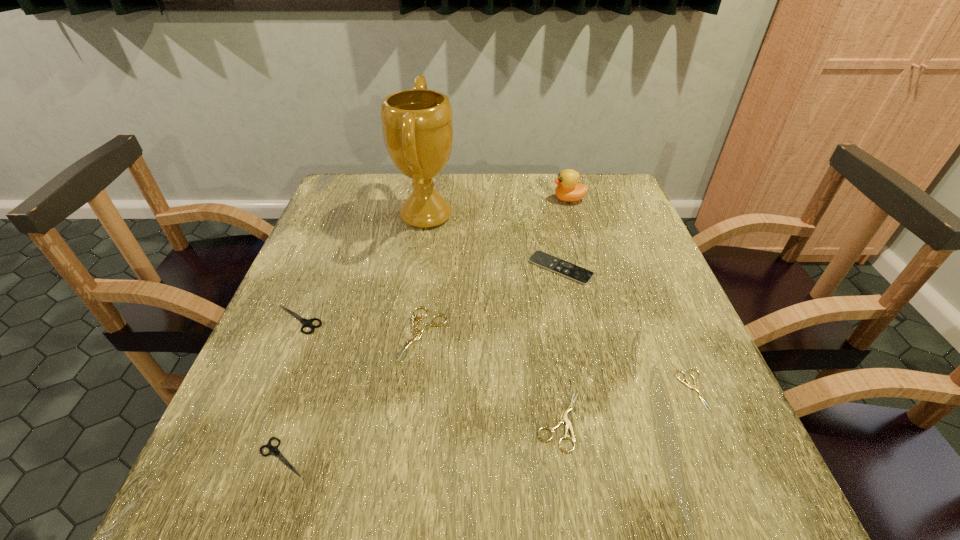
At what (x,y) coordinates should I click in order to perform the action: click on award. Please return your answer as a coordinate pair (x, y). Looking at the image, I should click on [417, 125].

The width and height of the screenshot is (960, 540). Find the location of `the seventh shortest object`. the seventh shortest object is located at coordinates (568, 189).

Where is `duckling`? This screenshot has height=540, width=960. duckling is located at coordinates point(568,189).

What are the coordinates of `the sixth shortest object` in the screenshot? It's located at (581, 275).

The image size is (960, 540). Identify the location of the bigger black shears. (306, 322).

At what (x,y) coordinates should I click in order to perform the action: click on the farthest beige shears. Please return your answer as a coordinate pair (x, y). The height and width of the screenshot is (540, 960). Looking at the image, I should click on (417, 333).

What are the coordinates of `the biggest beige shears` in the screenshot? It's located at point(417,333).

The height and width of the screenshot is (540, 960). I want to click on the second beige shears from right to left, so click(x=563, y=418).

This screenshot has width=960, height=540. I want to click on the second smallest beige shears, so click(x=563, y=418).

The image size is (960, 540). Identify the location of the nearer black shears. (273, 450).